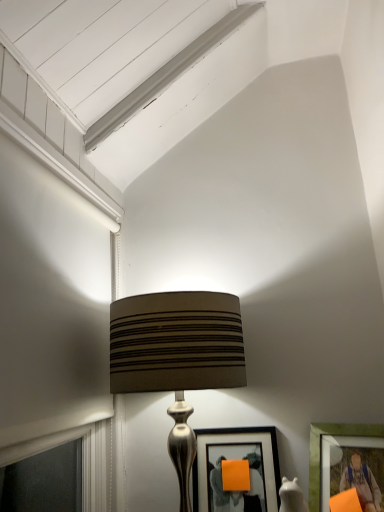
Question: Is matte brown fabric lampshade at center in front of or behind matte green picture frame at lower right, which is the 1th picture frame from right to left, in the image?

Choices:
 (A) behind
 (B) front

Answer: (B)

Question: From the image's perspective, is matte brown fabric lampshade at center positioned above or below matte green picture frame at lower right, the 2th picture frame viewed from the left?

Choices:
 (A) above
 (B) below

Answer: (A)

Question: Which object is positioned closest to the matte green picture frame at lower right, the 2th picture frame viewed from the left?

Choices:
 (A) matte brown fabric lampshade at center
 (B) matte black picture frame at center, acting as the second picture frame starting from the right

Answer: (B)

Question: Considering the real-world distances, which object is closest to the matte green picture frame at lower right, the 2th picture frame viewed from the left?

Choices:
 (A) matte black picture frame at center, the first picture frame when ordered from left to right
 (B) matte brown fabric lampshade at center

Answer: (A)